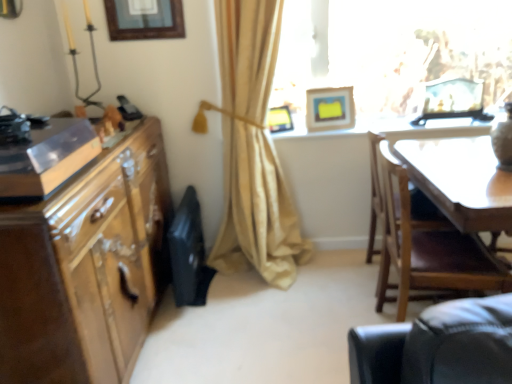
Question: Can you confirm if beige fabric curtain at center is thinner than white glossy table at upper center?

Choices:
 (A) no
 (B) yes

Answer: (A)

Question: Is beige fabric curtain at center shorter than white glossy table at upper center?

Choices:
 (A) no
 (B) yes

Answer: (A)

Question: From a real-world perspective, is beige fabric curtain at center under white glossy table at upper center?

Choices:
 (A) yes
 (B) no

Answer: (B)

Question: From a real-world perspective, is beige fabric curtain at center positioned over white glossy table at upper center based on gravity?

Choices:
 (A) yes
 (B) no

Answer: (A)

Question: Is beige fabric curtain at center to the right of white glossy table at upper center from the viewer's perspective?

Choices:
 (A) yes
 (B) no

Answer: (B)

Question: Is beige fabric curtain at center in contact with white glossy table at upper center?

Choices:
 (A) no
 (B) yes

Answer: (A)

Question: Can we say wooden picture frame at upper center, acting as the fourth picture frame starting from the right, lies outside matte yellow picture frame at upper center, the 2th picture frame when ordered from left to right?

Choices:
 (A) yes
 (B) no

Answer: (A)

Question: Considering the relative sizes of wooden picture frame at upper center, acting as the fourth picture frame starting from the right, and matte yellow picture frame at upper center, which is the 3th picture frame from right to left, in the image provided, is wooden picture frame at upper center, acting as the fourth picture frame starting from the right, shorter than matte yellow picture frame at upper center, which is the 3th picture frame from right to left,?

Choices:
 (A) yes
 (B) no

Answer: (B)

Question: Considering the relative sizes of wooden picture frame at upper center, the first picture frame when ordered from left to right, and matte yellow picture frame at upper center, which is the 3th picture frame from right to left, in the image provided, is wooden picture frame at upper center, the first picture frame when ordered from left to right, wider than matte yellow picture frame at upper center, which is the 3th picture frame from right to left,?

Choices:
 (A) yes
 (B) no

Answer: (B)

Question: Could you tell me if wooden picture frame at upper center, acting as the fourth picture frame starting from the right, is facing matte yellow picture frame at upper center, the 2th picture frame when ordered from left to right?

Choices:
 (A) no
 (B) yes

Answer: (A)

Question: Is wooden picture frame at upper center, acting as the fourth picture frame starting from the right, oriented away from matte yellow picture frame at upper center, which is the 3th picture frame from right to left?

Choices:
 (A) yes
 (B) no

Answer: (B)

Question: Is wooden picture frame at upper center, acting as the fourth picture frame starting from the right, far from matte yellow picture frame at upper center, the 2th picture frame when ordered from left to right?

Choices:
 (A) yes
 (B) no

Answer: (B)

Question: From the image's perspective, is white glossy table at upper center on top of translucent glass frame at upper right?

Choices:
 (A) no
 (B) yes

Answer: (A)